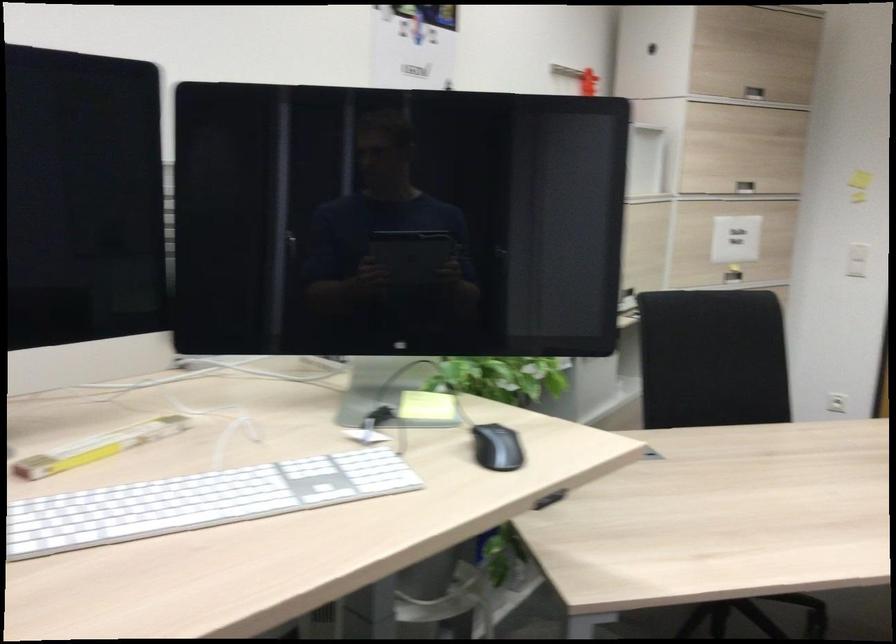
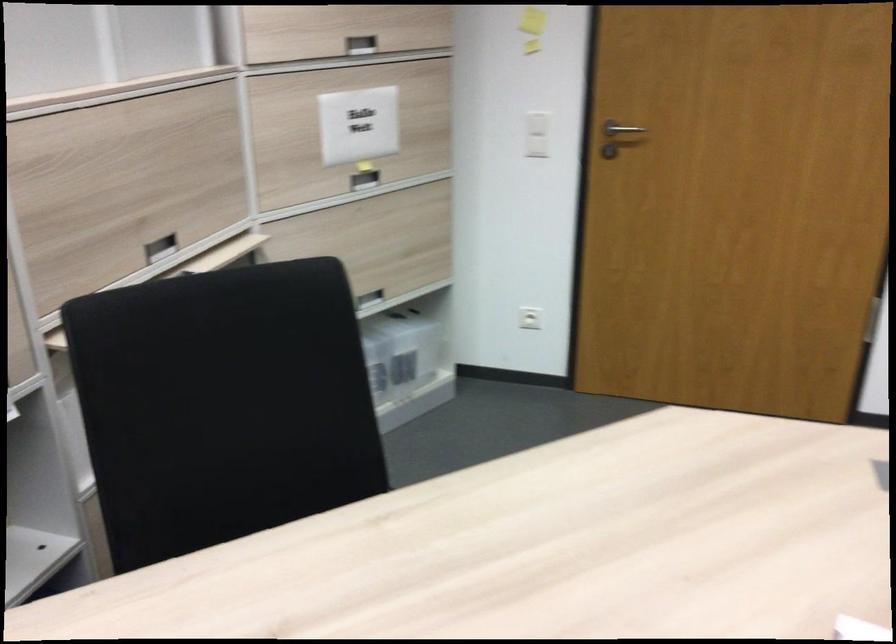
Locate, in the second image, the point that corresponds to point 741,277 in the first image.

(364, 180)